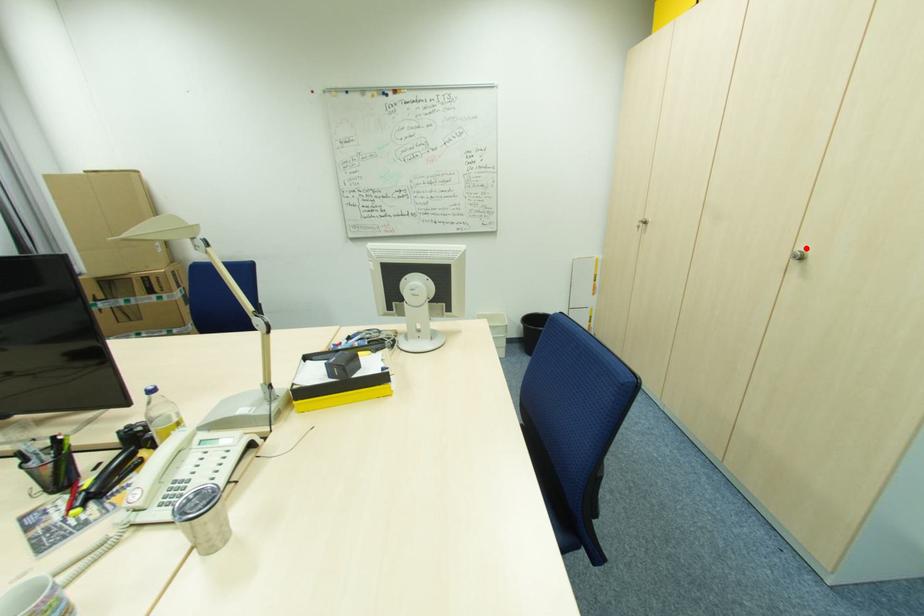
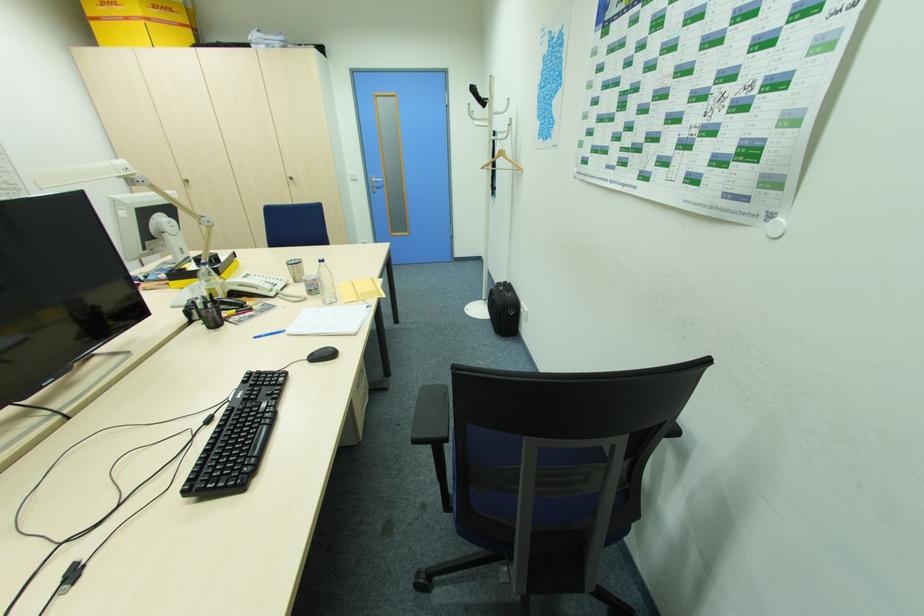
Where in the second image is the point corresponding to the highlighted location from the first image?

(292, 176)